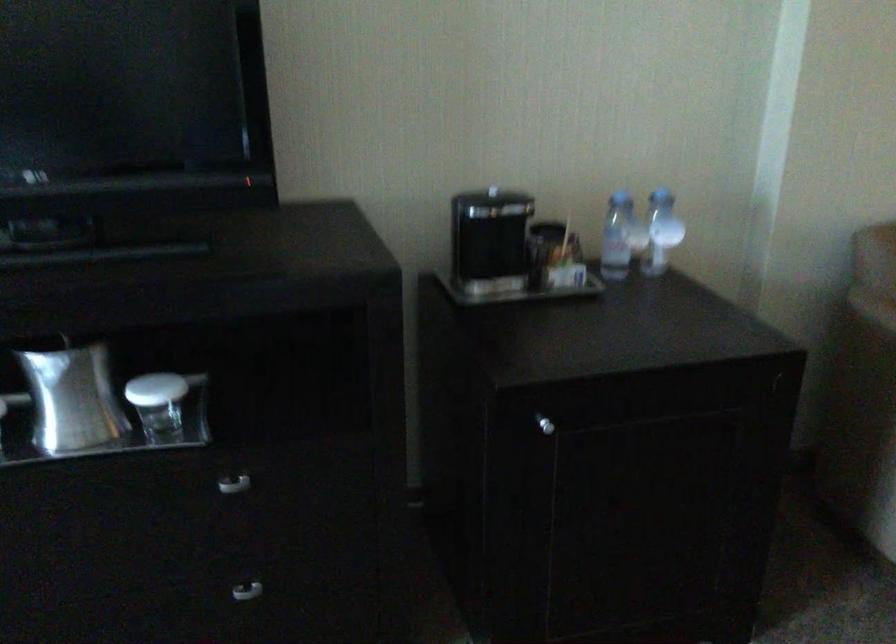
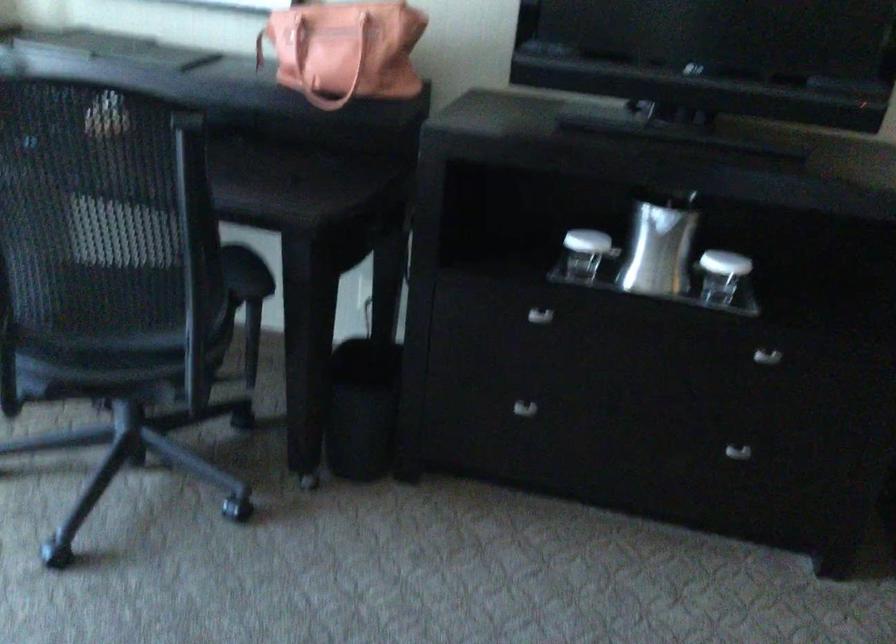
Find the pixel in the second image that matches the point at 71,391 in the first image.

(659, 245)